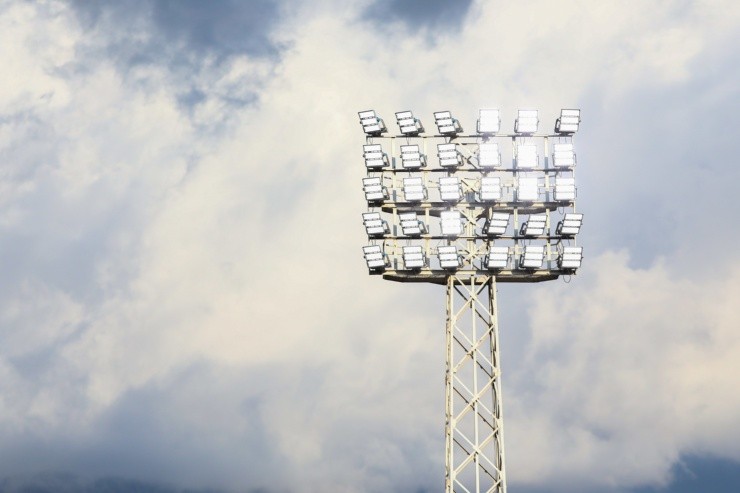
Locate an element on the screen. spotlight in bottom row is located at coordinates (373, 257), (413, 262), (442, 258), (496, 262), (536, 262), (573, 262).